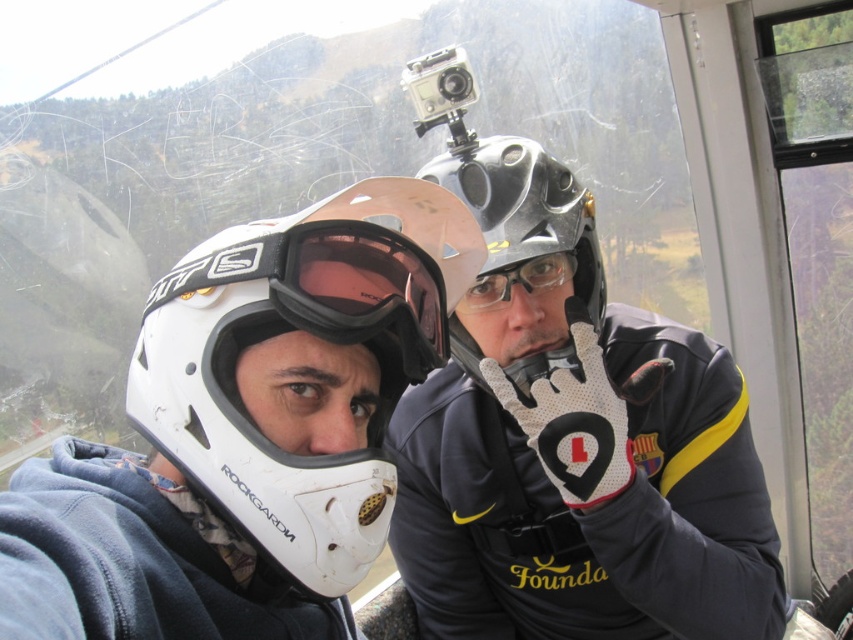
Does metallic silver helmet at upper right appear on the right side of white matte helmet at center?

Indeed, metallic silver helmet at upper right is positioned on the right side of white matte helmet at center.

In the scene shown: Between metallic silver helmet at upper right and white matte helmet at center, which one is positioned higher?

white matte helmet at center is above.

Who is more distant from viewer, [677,552] or [227,394]?

The point [677,552] is behind.

This screenshot has height=640, width=853. I want to click on metallic silver helmet at upper right, so click(575, 449).

Is white matte helmet at center to the right of metallic gray helmet at center from the viewer's perspective?

No, white matte helmet at center is not to the right of metallic gray helmet at center.

Which is more to the left, white matte helmet at center or metallic gray helmet at center?

white matte helmet at center

Between point (384, 230) and point (566, 228), which one is positioned in front?

Positioned in front is point (384, 230).

Identify the location of white matte helmet at center. (302, 365).

Who is taller, metallic silver helmet at upper right or transparent plastic goggles at center?

metallic silver helmet at upper right

Is metallic silver helmet at upper right smaller than transparent plastic goggles at center?

Incorrect, metallic silver helmet at upper right is not smaller in size than transparent plastic goggles at center.

Where is `metallic silver helmet at upper right`? The height and width of the screenshot is (640, 853). metallic silver helmet at upper right is located at coordinates (575, 449).

Identify the location of metallic silver helmet at upper right. (575, 449).